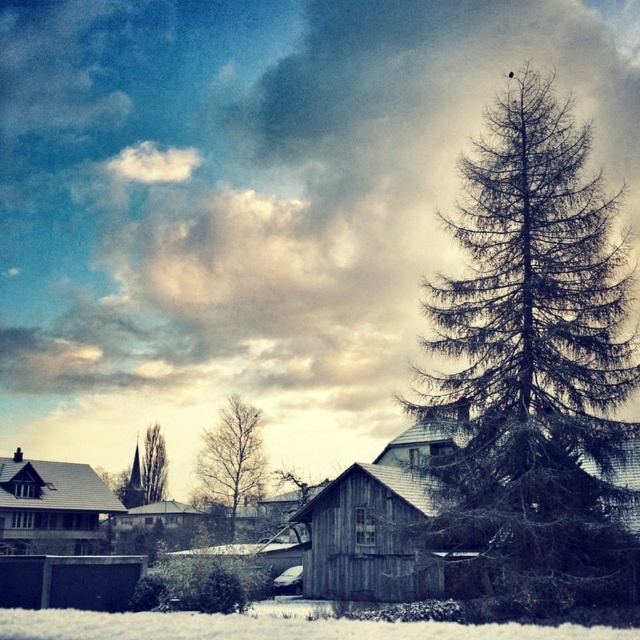
Is the position of wooden hut at left less distant than that of bare branches at center?

That is True.

Which of these two, wooden hut at left or bare branches at center, stands taller?

bare branches at center is taller.

Does point (44, 509) come behind point (224, 484)?

No, (44, 509) is in front of (224, 484).

Identify the location of wooden hut at left. (51, 506).

Between dark green textured pine tree at right and wooden hut at left, which one is positioned higher?

dark green textured pine tree at right

Who is lower down, dark green textured pine tree at right or wooden hut at left?

wooden hut at left

Which is behind, point (500, 321) or point (96, 492)?

Positioned behind is point (96, 492).

Where is `dark green textured pine tree at right`? dark green textured pine tree at right is located at coordinates (534, 358).

In the scene shown: Who is lower down, wooden shack at center or wooden hut at center?

wooden hut at center is lower down.

Who is more forward, (x=356, y=538) or (x=131, y=509)?

Point (x=356, y=538) is more forward.

Is point (340, 563) positioned in front of point (154, 518)?

Yes.

Find the location of a particular element. The width and height of the screenshot is (640, 640). wooden shack at center is located at coordinates (388, 524).